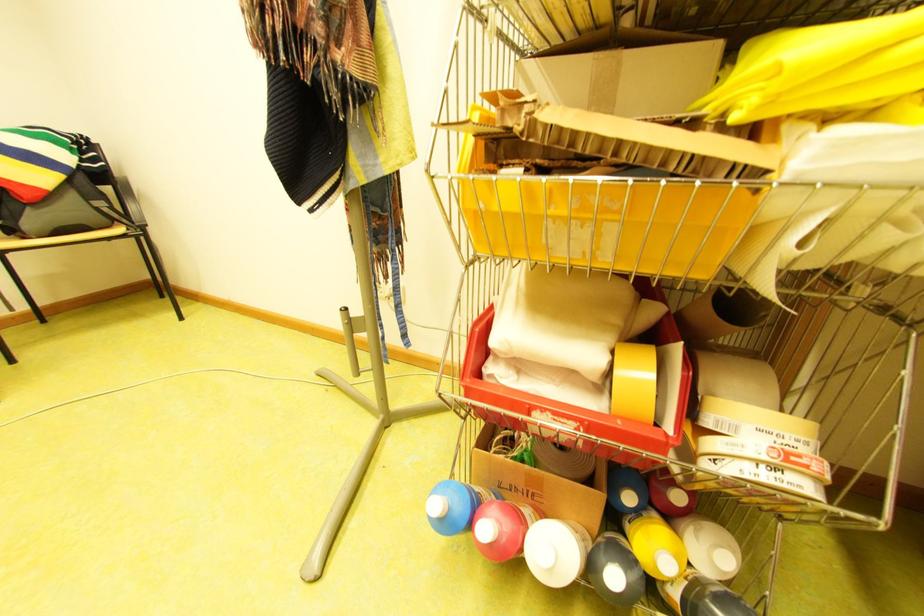
You are a GUI agent. You are given a task and a screenshot of the screen. Output one action in this format:
    pyautogui.click(x=<x>, y=<y>)
    Task: Click on the black-capped bottle
    
    Given the screenshot: What is the action you would take?
    pyautogui.click(x=701, y=596)